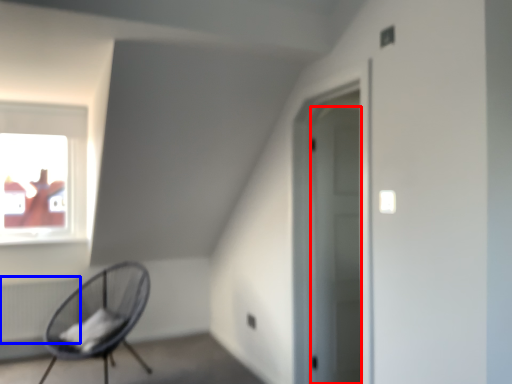
Question: Which object is further to the camera taking this photo, door (highlighted by a red box) or radiator (highlighted by a blue box)?

Choices:
 (A) door
 (B) radiator

Answer: (B)